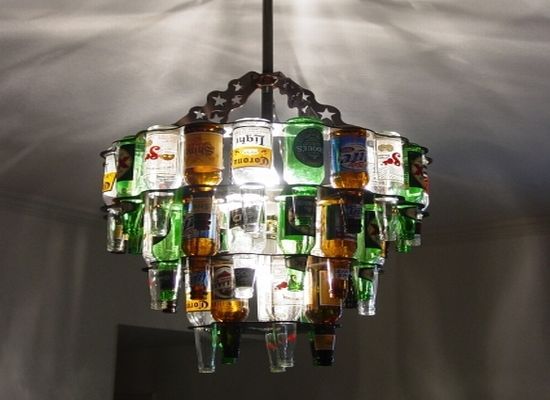
At what (x,y) coordinates should I click in order to perform the action: click on ceiling. Please return your answer as a coordinate pair (x, y). The width and height of the screenshot is (550, 400). Looking at the image, I should click on (419, 69).